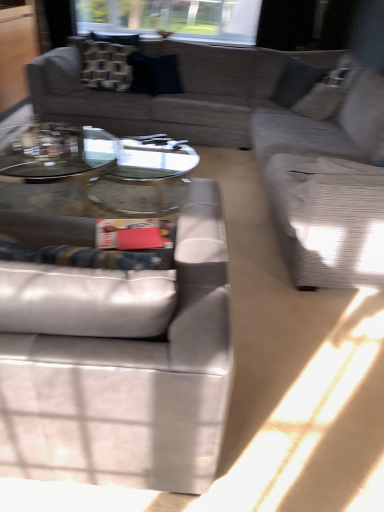
Question: From a real-world perspective, is textured gray couch at upper center, which is counted as the 2th studio couch, starting from the bottom, on textured gray couch at right?

Choices:
 (A) yes
 (B) no

Answer: (B)

Question: Is textured gray couch at upper center, which is the 1th studio couch in top-to-bottom order, outside of textured gray couch at right?

Choices:
 (A) no
 (B) yes

Answer: (B)

Question: From the image's perspective, is textured gray couch at upper center, the 1th studio couch when ordered from back to front, located beneath textured gray couch at right?

Choices:
 (A) no
 (B) yes

Answer: (A)

Question: Is textured gray couch at upper center, which is counted as the 2th studio couch, starting from the bottom, to the right of textured gray couch at right from the viewer's perspective?

Choices:
 (A) no
 (B) yes

Answer: (A)

Question: Is textured gray couch at upper center, the 1th studio couch when ordered from back to front, beside textured gray couch at right?

Choices:
 (A) yes
 (B) no

Answer: (B)

Question: Considering the relative positions of textured gray couch at upper center, which is the 1th studio couch in top-to-bottom order, and textured gray couch at right in the image provided, is textured gray couch at upper center, which is the 1th studio couch in top-to-bottom order, to the left of textured gray couch at right from the viewer's perspective?

Choices:
 (A) yes
 (B) no

Answer: (A)

Question: From a real-world perspective, does patterned fabric pillow at upper left, acting as the first pillow starting from the left, stand above transparent glass window at upper center?

Choices:
 (A) no
 (B) yes

Answer: (A)

Question: Does patterned fabric pillow at upper left, acting as the first pillow starting from the left, have a greater height compared to transparent glass window at upper center?

Choices:
 (A) yes
 (B) no

Answer: (A)

Question: Does patterned fabric pillow at upper left, acting as the first pillow starting from the left, contain transparent glass window at upper center?

Choices:
 (A) yes
 (B) no

Answer: (B)

Question: From a real-world perspective, is patterned fabric pillow at upper left, acting as the first pillow starting from the left, located beneath transparent glass window at upper center?

Choices:
 (A) yes
 (B) no

Answer: (A)

Question: Can you confirm if patterned fabric pillow at upper left, marked as the second pillow in a right-to-left arrangement, is wider than transparent glass window at upper center?

Choices:
 (A) yes
 (B) no

Answer: (B)

Question: Considering the relative positions of patterned fabric pillow at upper left, acting as the first pillow starting from the left, and transparent glass window at upper center in the image provided, is patterned fabric pillow at upper left, acting as the first pillow starting from the left, to the left of transparent glass window at upper center from the viewer's perspective?

Choices:
 (A) no
 (B) yes

Answer: (B)

Question: Is clear glass coffee table at center positioned far away from transparent glass window at upper center?

Choices:
 (A) yes
 (B) no

Answer: (A)